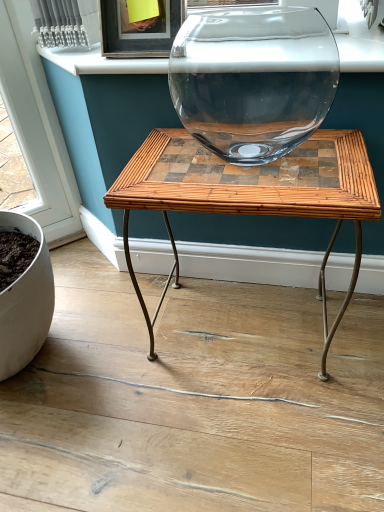
The height and width of the screenshot is (512, 384). Find the location of `free point below bamboo/rattan table at center (from a real-world perspective)`. free point below bamboo/rattan table at center (from a real-world perspective) is located at coordinates (254, 325).